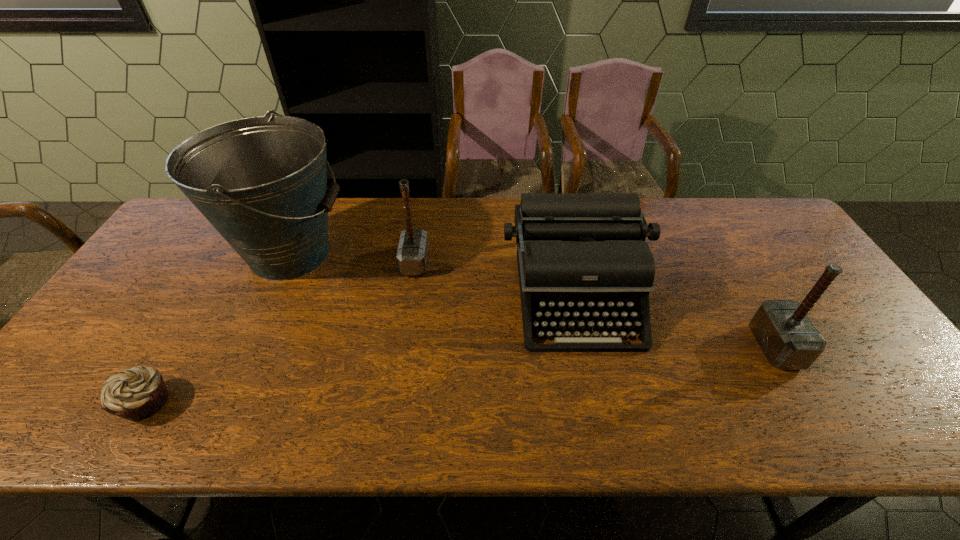
In order to click on object that is the second closest to the left hammer in this screenshot , I will do `click(580, 255)`.

This screenshot has height=540, width=960. I want to click on free region that satisfies the following two spatial constraints: 1. with the handle on opposite sides of the tallest object; 2. on the left side of the rightmost object, so click(248, 347).

Image resolution: width=960 pixels, height=540 pixels. In order to click on vacant space that satisfies the following two spatial constraints: 1. on the back side of the rightmost object; 2. on the striking surface of the farther hammer in this screenshot , I will do `click(726, 262)`.

Locate an element on the screen. The height and width of the screenshot is (540, 960). vacant space that satisfies the following two spatial constraints: 1. on the back side of the nearer hammer; 2. on the striking surface of the farther hammer is located at coordinates (726, 262).